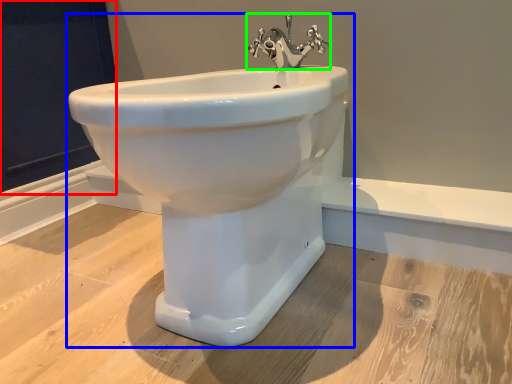
Question: Which object is the closest to the screen door (highlighted by a red box)? Choose among these: sink (highlighted by a blue box) or tap (highlighted by a green box).

Choices:
 (A) sink
 (B) tap

Answer: (B)